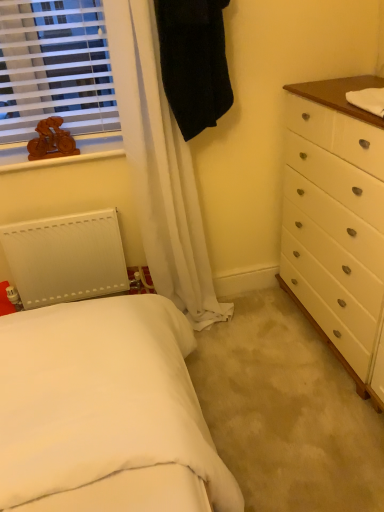
You are a GUI agent. You are given a task and a screenshot of the screen. Output one action in this format:
    pyautogui.click(x=<x>, y=<y>)
    Task: Click on the empty space that is ontop of wooden bicycle at upper left (from a real-world perspective)
    The width and height of the screenshot is (384, 512).
    Given the screenshot: What is the action you would take?
    pyautogui.click(x=61, y=153)